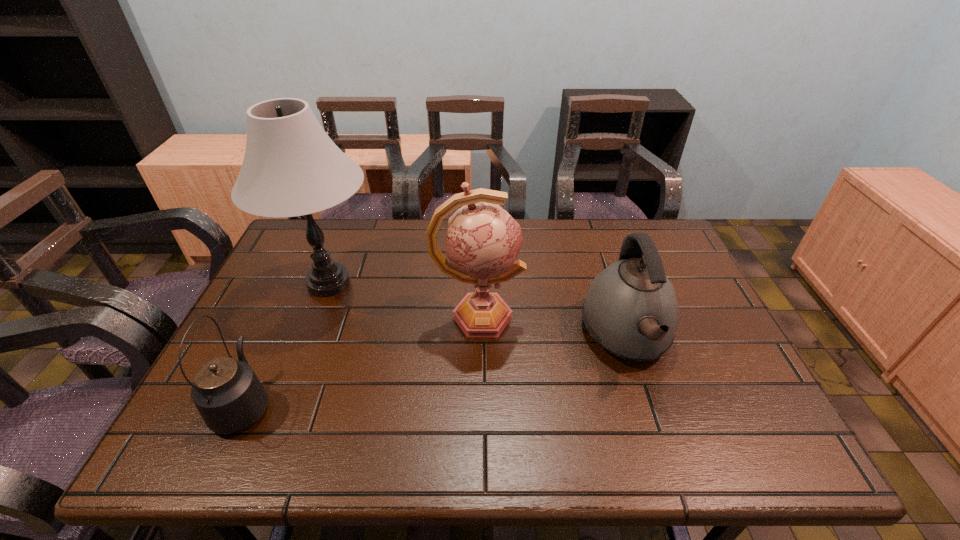
Find the location of a particular element. free spot between the left kettle and the rightmost object is located at coordinates (436, 370).

Locate an element on the screen. vacant space that is in between the rightmost object and the left kettle is located at coordinates (436, 370).

The width and height of the screenshot is (960, 540). Find the location of `object that is the second nearest to the third object from left to right`. object that is the second nearest to the third object from left to right is located at coordinates (291, 167).

Locate an element on the screen. the second closest object to the rightmost object is located at coordinates (291, 167).

You are a GUI agent. You are given a task and a screenshot of the screen. Output one action in this format:
    pyautogui.click(x=<x>, y=<y>)
    Task: Click on the free space that satisfies the following two spatial constraints: 1. spout on the tallest object; 2. on the right side of the left kettle
    The height and width of the screenshot is (540, 960).
    Given the screenshot: What is the action you would take?
    pyautogui.click(x=300, y=283)

Identify the location of free space that satisfies the following two spatial constraints: 1. spout on the lamp; 2. on the left side of the left kettle. The width and height of the screenshot is (960, 540). (300, 283).

Where is `free spot that satisfies the following two spatial constraints: 1. spout on the tallest object; 2. on the right side of the left kettle`? free spot that satisfies the following two spatial constraints: 1. spout on the tallest object; 2. on the right side of the left kettle is located at coordinates (300, 283).